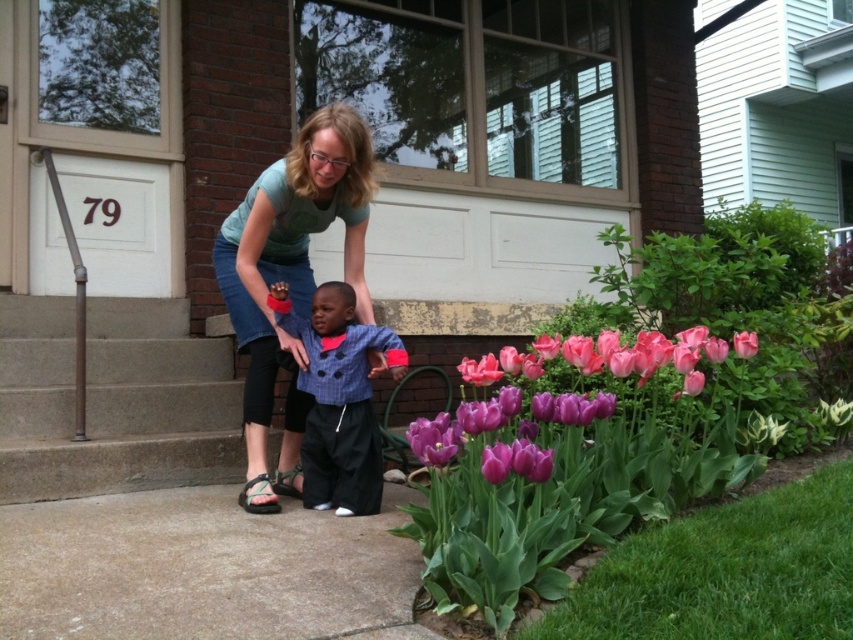
The width and height of the screenshot is (853, 640). In order to click on gray concrete pavement at lower center in this screenshot , I will do `click(202, 570)`.

Is gray concrete pavement at lower center above concrete at left?

→ Actually, gray concrete pavement at lower center is below concrete at left.

Describe the element at coordinates (202, 570) in the screenshot. I see `gray concrete pavement at lower center` at that location.

What are the coordinates of `gray concrete pavement at lower center` in the screenshot? It's located at (202, 570).

Looking at this image, can you confirm if denim skirt at center is smaller than blue textured shirt at center?

Incorrect, denim skirt at center is not smaller in size than blue textured shirt at center.

Is point (352, 128) farther from camera compared to point (350, 506)?

No, (352, 128) is closer to viewer.

You are a GUI agent. You are given a task and a screenshot of the screen. Output one action in this format:
    pyautogui.click(x=<x>, y=<y>)
    Task: Click on the denim skirt at center
    
    Given the screenshot: What is the action you would take?
    pyautogui.click(x=289, y=276)

Who is higher up, gray concrete pavement at lower center or pink glossy tulip at center?

pink glossy tulip at center is above.

Describe the element at coordinates (202, 570) in the screenshot. I see `gray concrete pavement at lower center` at that location.

Is point (85, 524) closer to camera compared to point (502, 355)?

That is True.

Identify the location of gray concrete pavement at lower center. Image resolution: width=853 pixels, height=640 pixels. (202, 570).